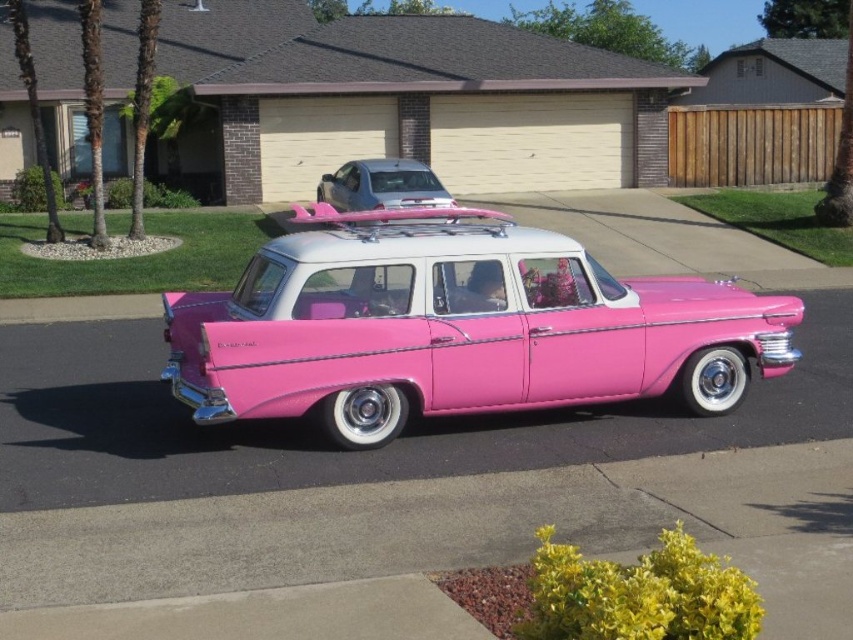
You are a pedestrian standing on the sidewalk and want to cross the street to reach the house with the beige garage door. There is a pink glossy car at center and a metallic silver minivan at upper center in your view. Which vehicle is closer to you that you need to be cautious of?

The pink glossy car at center is closer to the viewer than the metallic silver minivan at upper center, so you need to be cautious of the pink glossy car at center first.

You are a delivery person trying to park a small van next to the pink glossy car at center and the pink glossy station wagon at center. Which vehicle should you park below to avoid blocking the driveway?

The pink glossy car at center is located below the pink glossy station wagon at center, so you should park below the pink glossy station wagon at center to avoid blocking the driveway.